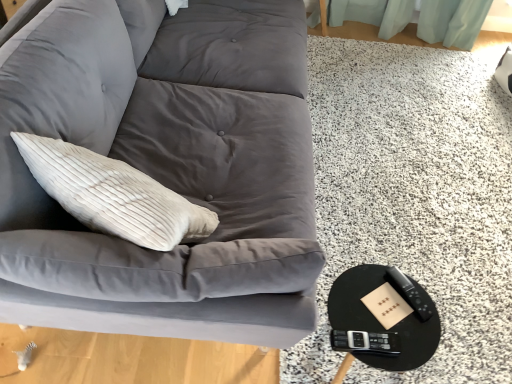
Describe the element at coordinates (169, 175) in the screenshot. The image size is (512, 384). I see `matte gray fabric couch at upper left` at that location.

Locate an element on the screen. The height and width of the screenshot is (384, 512). matte gray fabric couch at upper left is located at coordinates (169, 175).

Which object is closer to the camera, black glossy round table at lower right or black plastic remote at lower right?

Positioned in front is black glossy round table at lower right.

Which is more to the right, black glossy round table at lower right or black plastic remote at lower right?

From the viewer's perspective, black plastic remote at lower right appears more on the right side.

Based on the photo, is black glossy round table at lower right shorter than black plastic remote at lower right?

Incorrect, the height of black glossy round table at lower right does not fall short of that of black plastic remote at lower right.

In the scene shown: Considering the relative positions of black plastic remote at lower right and black glossy round table at lower right in the image provided, is black plastic remote at lower right to the left of black glossy round table at lower right from the viewer's perspective?

Incorrect, black plastic remote at lower right is not on the left side of black glossy round table at lower right.

Does point (400, 294) appear closer or farther from the camera than point (342, 319)?

Point (400, 294) is positioned farther from the camera compared to point (342, 319).

Considering the relative sizes of black plastic remote at lower right and black glossy round table at lower right in the image provided, is black plastic remote at lower right smaller than black glossy round table at lower right?

Yes.

Is black plastic remote at lower right situated inside black glossy round table at lower right or outside?

black plastic remote at lower right is spatially positioned inside black glossy round table at lower right.

Does matte gray fabric couch at upper left have a smaller size compared to black glossy round table at lower right?

No.

Which object is closer to the camera, matte gray fabric couch at upper left or black glossy round table at lower right?

matte gray fabric couch at upper left.

Are matte gray fabric couch at upper left and black glossy round table at lower right located far from each other?

matte gray fabric couch at upper left is actually quite close to black glossy round table at lower right.

Between matte gray fabric couch at upper left and black glossy round table at lower right, which one appears on the left side from the viewer's perspective?

Positioned to the left is matte gray fabric couch at upper left.

Based on the photo, does black plastic remote at lower right have a greater width compared to matte gray fabric couch at upper left?

In fact, black plastic remote at lower right might be narrower than matte gray fabric couch at upper left.

Does black plastic remote at lower right come in front of matte gray fabric couch at upper left?

No.

Looking at this image, is black plastic remote at lower right placed right next to matte gray fabric couch at upper left?

black plastic remote at lower right and matte gray fabric couch at upper left are clearly separated.

Would you say matte gray fabric couch at upper left contains black plastic remote at lower right?

That's incorrect, black plastic remote at lower right is not inside matte gray fabric couch at upper left.

From the picture: From a real-world perspective, is matte gray fabric couch at upper left located beneath black plastic remote at lower right?

No.

Can you confirm if matte gray fabric couch at upper left is wider than black plastic remote at lower right?

Indeed, matte gray fabric couch at upper left has a greater width compared to black plastic remote at lower right.

Does matte gray fabric couch at upper left have a lesser height compared to black plastic remote at lower right?

Incorrect, the height of matte gray fabric couch at upper left does not fall short of that of black plastic remote at lower right.

In the image, is black glossy round table at lower right positioned in front of or behind matte gray fabric couch at upper left?

Clearly, black glossy round table at lower right is behind matte gray fabric couch at upper left.

Is matte gray fabric couch at upper left completely or partially inside black glossy round table at lower right?

Actually, matte gray fabric couch at upper left is outside black glossy round table at lower right.

Looking at this image, considering the sizes of objects black glossy round table at lower right and matte gray fabric couch at upper left in the image provided, who is taller, black glossy round table at lower right or matte gray fabric couch at upper left?

With more height is matte gray fabric couch at upper left.

I want to click on round table lying in front of the black plastic remote at lower right, so point(380,323).

I want to click on round table below the black plastic remote at lower right (from a real-world perspective), so click(x=380, y=323).

From the image, which object appears to be nearer to black glossy round table at lower right, black plastic remote at lower right or matte gray fabric couch at upper left?

The object closer to black glossy round table at lower right is black plastic remote at lower right.

Considering their positions, is black glossy round table at lower right positioned further to black plastic remote at lower right than matte gray fabric couch at upper left?

Among the two, matte gray fabric couch at upper left is located further to black plastic remote at lower right.

Based on their spatial positions, is matte gray fabric couch at upper left or black plastic remote at lower right further from black glossy round table at lower right?

Among the two, matte gray fabric couch at upper left is located further to black glossy round table at lower right.

In the scene shown: Looking at the image, which one is located further to matte gray fabric couch at upper left, black plastic remote at lower right or black glossy round table at lower right?

The object further to matte gray fabric couch at upper left is black plastic remote at lower right.

When comparing their distances from matte gray fabric couch at upper left, does black glossy round table at lower right or black plastic remote at lower right seem closer?

black glossy round table at lower right lies closer to matte gray fabric couch at upper left than the other object.

Looking at the image, which one is located further to black plastic remote at lower right, matte gray fabric couch at upper left or black glossy round table at lower right?

matte gray fabric couch at upper left is further to black plastic remote at lower right.

Identify the location of round table between matte gray fabric couch at upper left and black plastic remote at lower right. This screenshot has height=384, width=512. (380, 323).